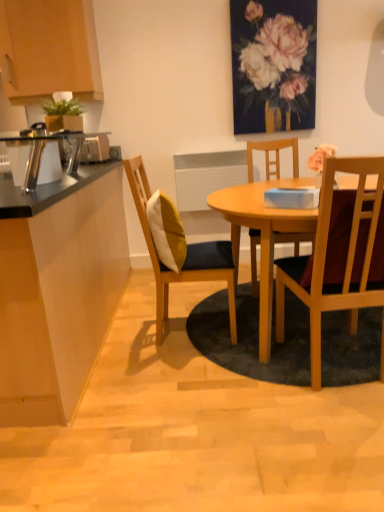
You are a GUI agent. You are given a task and a screenshot of the screen. Output one action in this format:
    pyautogui.click(x=<x>, y=<y>)
    Task: Click on the free space in front of wooden chair at right, which is the first chair in right-to-left order
    The image size is (384, 512).
    Given the screenshot: What is the action you would take?
    (x=332, y=428)